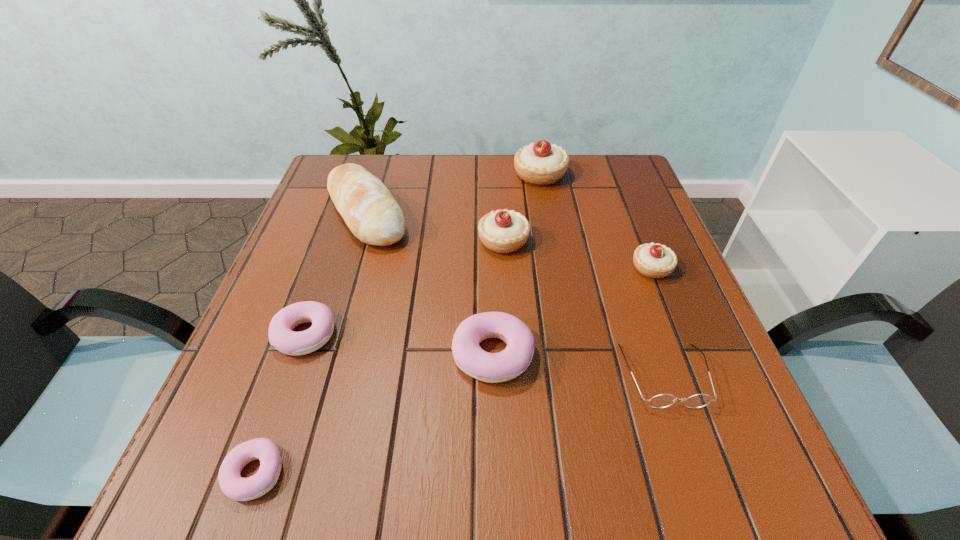
Where is `free space between the bread and the fourth shortest object`? free space between the bread and the fourth shortest object is located at coordinates (430, 284).

You are a GUI agent. You are given a task and a screenshot of the screen. Output one action in this format:
    pyautogui.click(x=<x>, y=<y>)
    Task: Click on the free space between the beige bread and the farthest pastry
    
    Given the screenshot: What is the action you would take?
    pyautogui.click(x=453, y=194)

This screenshot has width=960, height=540. I want to click on object that is the fifth nearest to the spectacles, so click(x=540, y=163).

At what (x,y) coordinates should I click in order to perform the action: click on object that is the fourth nearest to the third tallest object. Please return your answer as a coordinate pair (x, y). This screenshot has width=960, height=540. Looking at the image, I should click on (652, 260).

Identify the location of pastry that stands as the fifth closest to the fifth tallest pastry. The height and width of the screenshot is (540, 960). (652, 260).

Select which pastry appears as the fourth closest to the fifth tallest object. Please provide its 2D coordinates. Your answer should be formatted as a tuple, i.e. [(x, y)], where the tuple contains the x and y coordinates of a point satisfying the conditions above.

[(235, 487)]

The image size is (960, 540). I want to click on the closest beige pastry relative to the rightmost pastry, so click(x=505, y=231).

Locate which beige pastry ranks third in proximity to the dark spectacles. Please provide its 2D coordinates. Your answer should be formatted as a tuple, i.e. [(x, y)], where the tuple contains the x and y coordinates of a point satisfying the conditions above.

[(540, 163)]

In order to click on pink pastry identified as the second closest to the second smallest beige pastry in this screenshot , I will do `click(281, 336)`.

This screenshot has width=960, height=540. I want to click on the third closest pink pastry relative to the farthest pastry, so click(235, 487).